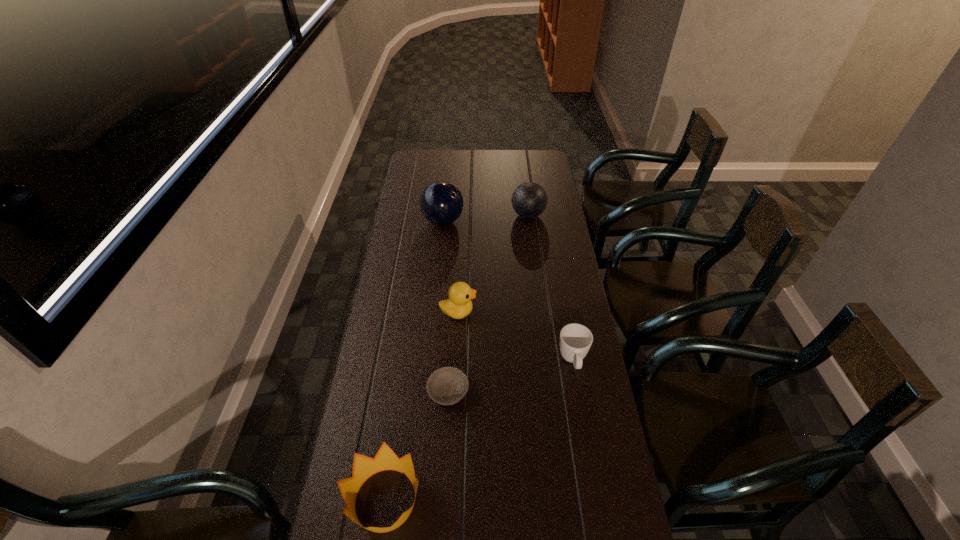
Locate an element on the screen. The image size is (960, 540). the taller bowling ball is located at coordinates (441, 203).

Locate an element on the screen. The height and width of the screenshot is (540, 960). the left bowling ball is located at coordinates (441, 203).

Find the location of a particular element. The height and width of the screenshot is (540, 960). the shorter bowling ball is located at coordinates (529, 200).

Locate an element on the screen. The width and height of the screenshot is (960, 540). duck is located at coordinates (459, 305).

You are a GUI agent. You are given a task and a screenshot of the screen. Output one action in this format:
    pyautogui.click(x=<x>, y=<y>)
    Task: Click on the fifth tallest object
    
    Given the screenshot: What is the action you would take?
    pyautogui.click(x=575, y=339)

You are a GUI agent. You are given a task and a screenshot of the screen. Output one action in this format:
    pyautogui.click(x=<x>, y=<y>)
    Task: Click on the shortest object
    Image resolution: width=960 pixels, height=540 pixels.
    Given the screenshot: What is the action you would take?
    pyautogui.click(x=448, y=385)

This screenshot has height=540, width=960. I want to click on free space located on the surface of the tallest object near the finger holes, so click(x=540, y=221).

Where is `vacant space located 0.110m on the grip area of the right bowling ball`? vacant space located 0.110m on the grip area of the right bowling ball is located at coordinates (487, 215).

The image size is (960, 540). Identify the location of vacant point located 0.390m on the grip area of the right bowling ball. (424, 215).

Find the location of a particular element. This screenshot has width=960, height=540. vacant area situated 0.250m on the grip area of the right bowling ball is located at coordinates (455, 215).